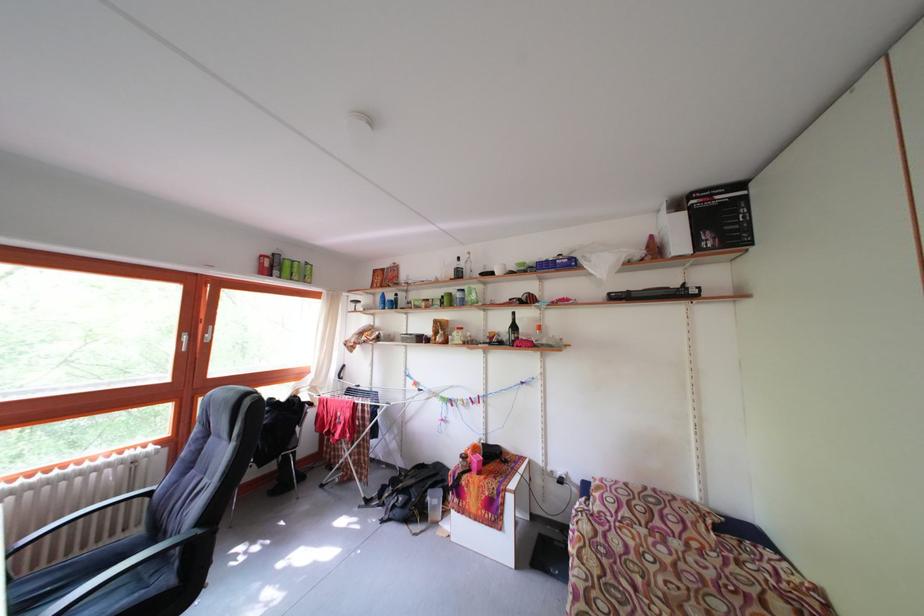
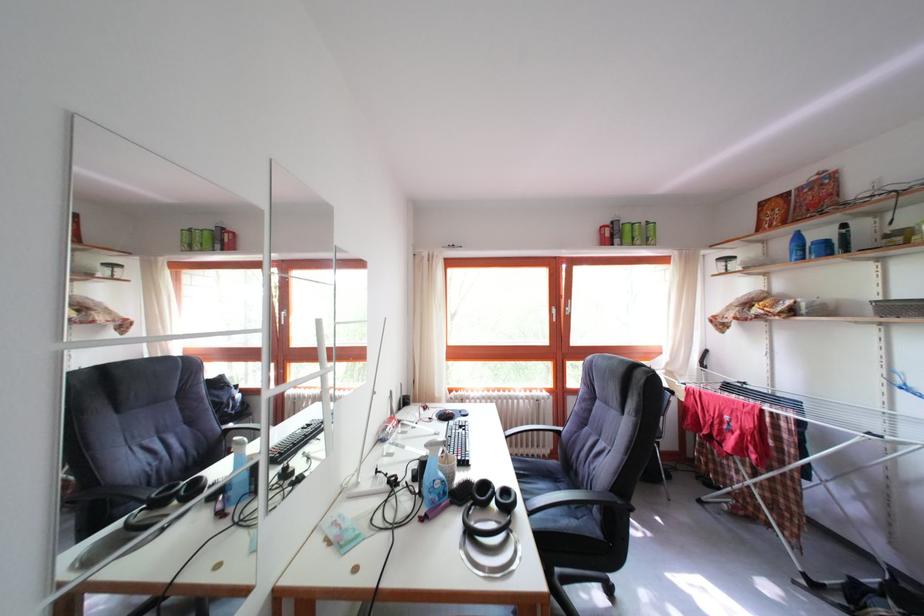
Question: The camera is either moving clockwise (left) or counter-clockwise (right) around the object. The first image is from the beginning of the video and the second image is from the end. Is the camera moving left or right when shooting the video?

Choices:
 (A) Left
 (B) Right

Answer: (B)